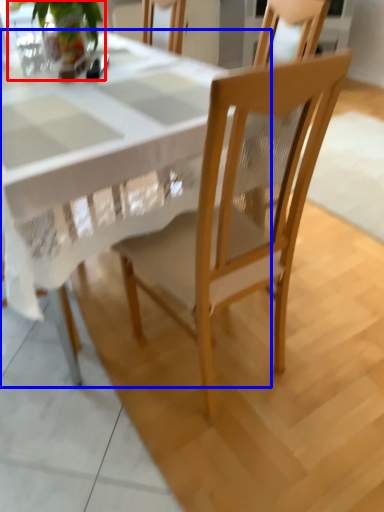
Question: Which object appears farthest to the camera in this image, houseplant (highlighted by a red box) or round table (highlighted by a blue box)?

Choices:
 (A) houseplant
 (B) round table

Answer: (A)